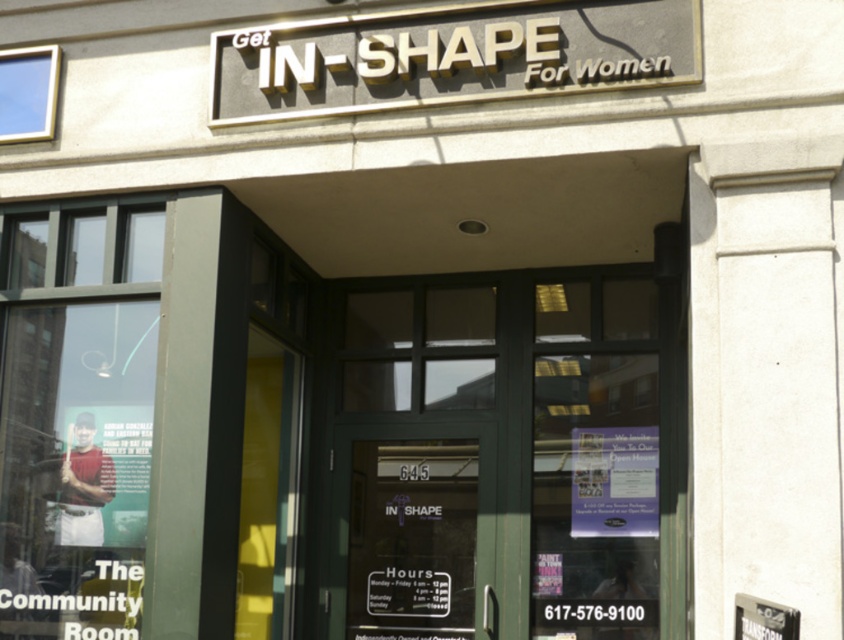
Is gold metallic sign at upper center wider than matte paper flyer at center?

Correct, the width of gold metallic sign at upper center exceeds that of matte paper flyer at center.

Describe the element at coordinates (450, 56) in the screenshot. I see `gold metallic sign at upper center` at that location.

The height and width of the screenshot is (640, 844). Describe the element at coordinates (450, 56) in the screenshot. I see `gold metallic sign at upper center` at that location.

What are the coordinates of `gold metallic sign at upper center` in the screenshot? It's located at (450, 56).

Between gold metallic sign at upper center and green glass door at center, which one has less height?

Standing shorter between the two is gold metallic sign at upper center.

Measure the distance between point (487, 61) and camera.

16.93 feet

This screenshot has width=844, height=640. What do you see at coordinates (450, 56) in the screenshot?
I see `gold metallic sign at upper center` at bounding box center [450, 56].

Where is `gold metallic sign at upper center`? gold metallic sign at upper center is located at coordinates (450, 56).

Which of these two, green glass door at center or matte paper flyer at center, stands taller?

green glass door at center is taller.

This screenshot has width=844, height=640. Describe the element at coordinates (406, 536) in the screenshot. I see `green glass door at center` at that location.

Find the location of a particular element. This screenshot has height=640, width=844. green glass door at center is located at coordinates (x=406, y=536).